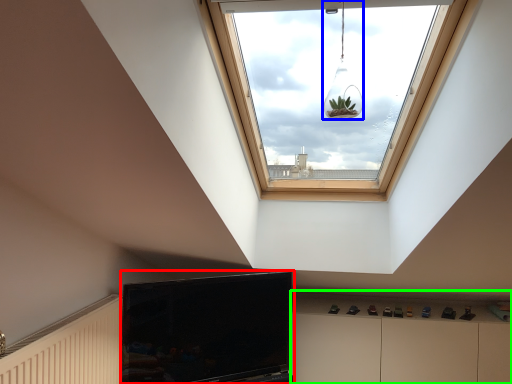
Question: Based on their relative distances, which object is farther from television (highlighted by a red box)? Choose from light fixture (highlighted by a blue box) and dresser (highlighted by a green box).

Choices:
 (A) light fixture
 (B) dresser

Answer: (A)